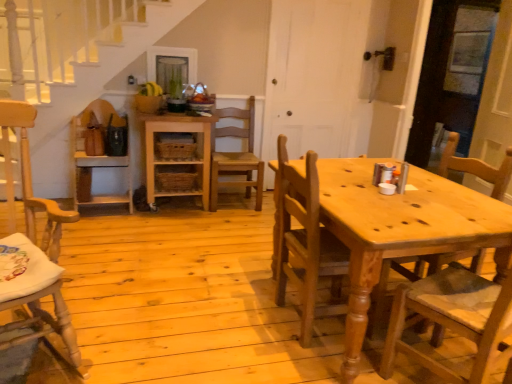
Locate an element on the screen. This screenshot has width=512, height=384. vacant area that lies between light brown wood chair at left, marked as the 2th chair in a left-to-right arrangement, and wooden chair at center, the first chair positioned from the left is located at coordinates click(94, 265).